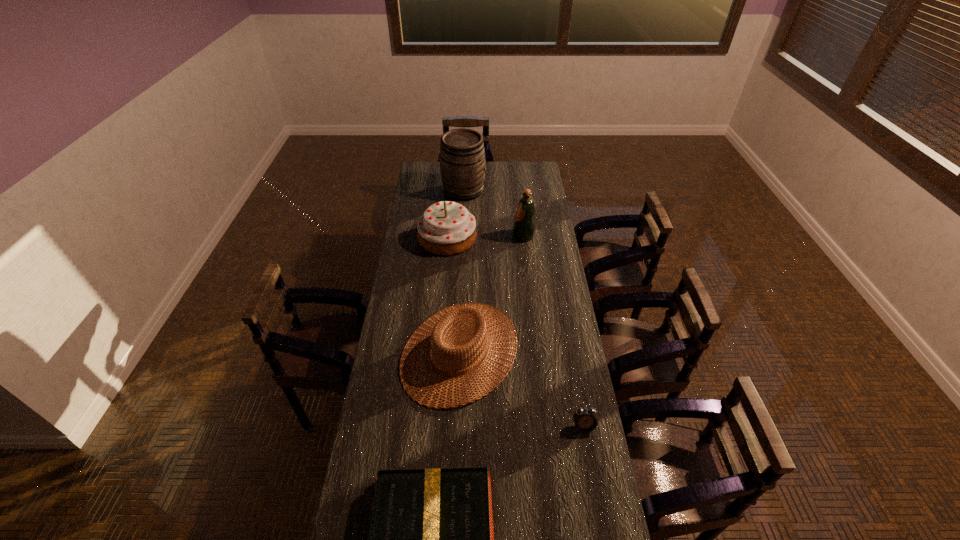
Find the location of `free region located on the front-facing side of the olive oil`. free region located on the front-facing side of the olive oil is located at coordinates (466, 236).

Locate an element on the screen. free spot located 0.140m on the front-facing side of the olive oil is located at coordinates (485, 236).

I want to click on vacant space located 0.150m on the front-facing side of the olive oil, so click(x=483, y=236).

At what (x,y) coordinates should I click in order to perform the action: click on vacant area situated 0.100m on the front of the cake. Please return your answer as a coordinate pair (x, y). The height and width of the screenshot is (540, 960). Looking at the image, I should click on (444, 272).

The height and width of the screenshot is (540, 960). In order to click on free space located on the back of the fourth tallest object in this screenshot , I will do `click(464, 266)`.

The image size is (960, 540). What are the coordinates of `vacant space located on the face of the second nearest object` in the screenshot? It's located at (595, 490).

The image size is (960, 540). In order to click on object located in the far edge section of the desktop in this screenshot , I will do `click(462, 156)`.

Find the location of `wine bucket at the left edge`. wine bucket at the left edge is located at coordinates (462, 156).

Where is `cake at the left edge`? The width and height of the screenshot is (960, 540). cake at the left edge is located at coordinates (446, 228).

The image size is (960, 540). What are the coordinates of `sunhat located in the left edge section of the desktop` in the screenshot? It's located at (478, 319).